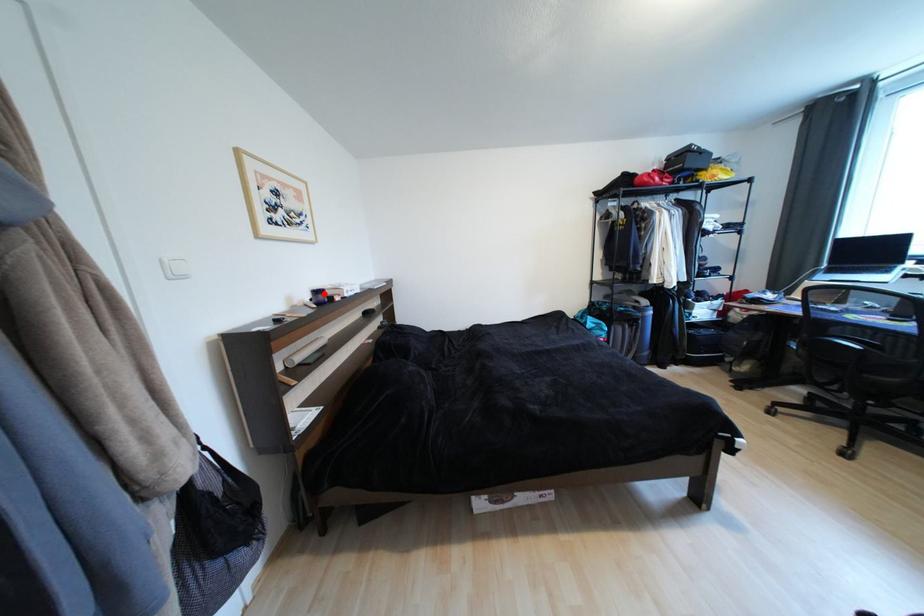
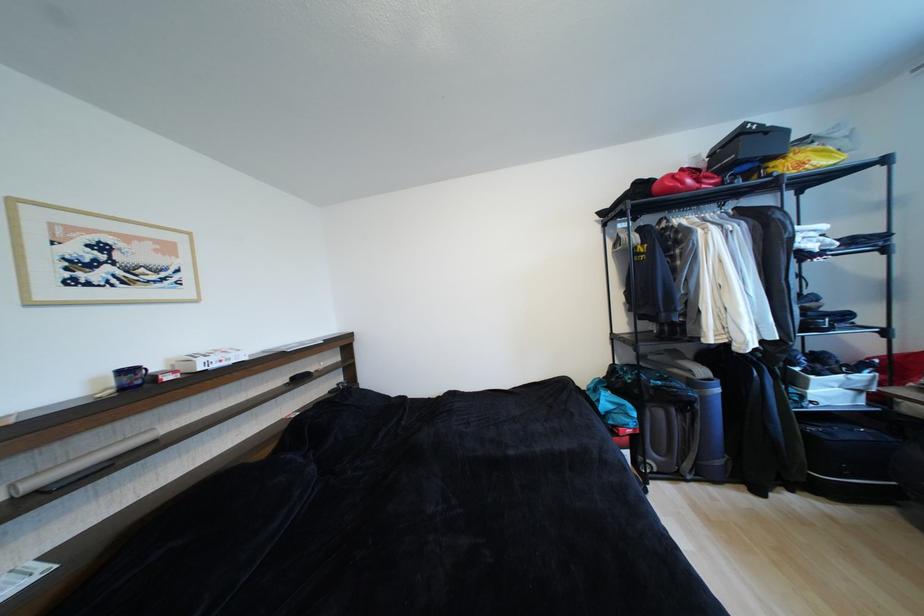
The point at the highlighted location is marked in the first image. Where is the corresponding point in the second image?

(134, 373)